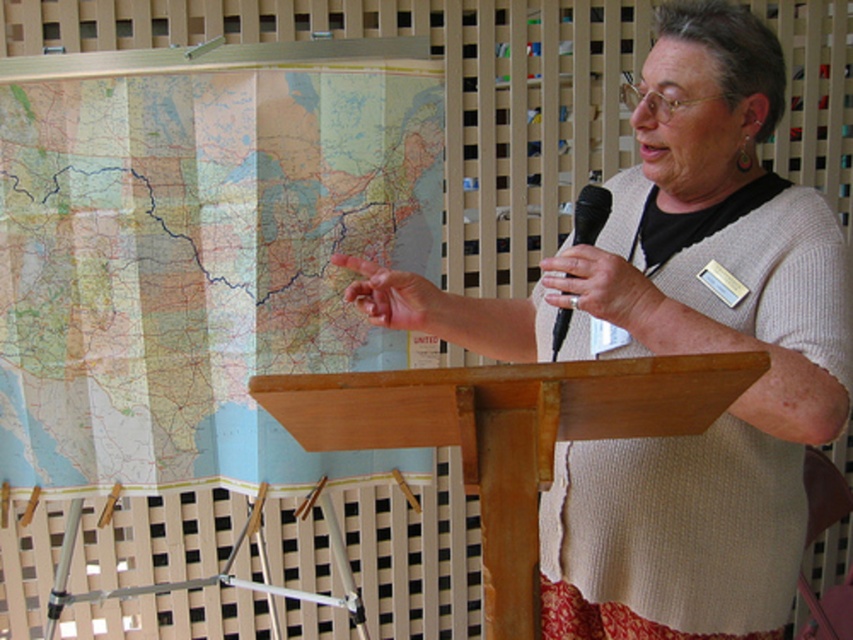
You are an attendee at a conference and need to know if the speaker is holding the microphone while gesturing. Based on the scene, can you determine if the knitted beige sweater at center is closer to you than the black plastic microphone at upper right?

The knitted beige sweater at center is in front of the black plastic microphone at upper right, so yes, the speaker is holding the microphone while gesturing and the sweater is closer to you.

You are an event organizer setting up a presentation area. The venue requires that the distance between the paper map at left and the wooden podium at center must be at least 36 inches to accommodate attendees. Based on the scene provided, will this requirement be met?

The paper map at left and wooden podium at center are 36.14 inches apart, which exceeds the required 36 inches, so the requirement is met.